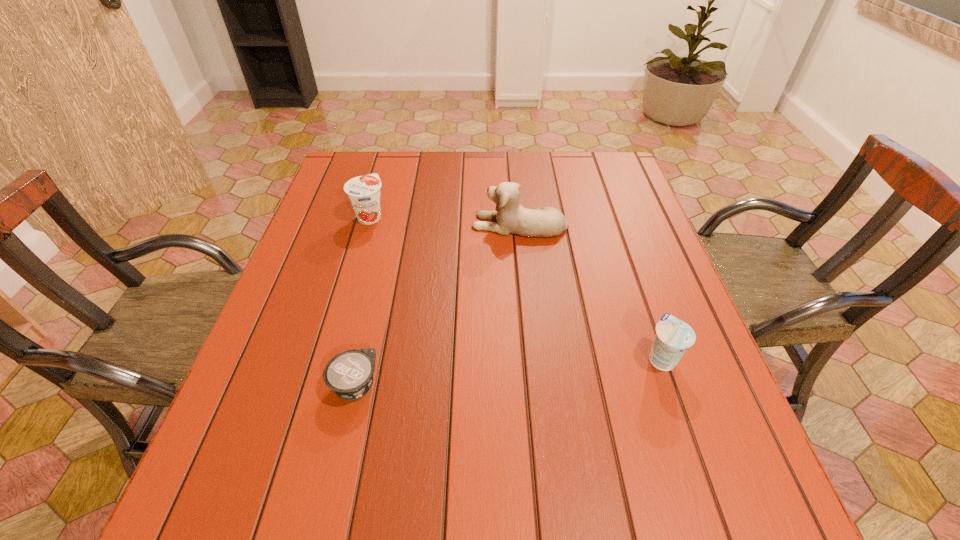
Find the location of `free space that is in between the shortest yogurt and the rightmost yogurt`. free space that is in between the shortest yogurt and the rightmost yogurt is located at coordinates (508, 372).

You are a GUI agent. You are given a task and a screenshot of the screen. Output one action in this format:
    pyautogui.click(x=<x>, y=<y>)
    Task: Click on the free area in between the shortest yogurt and the farthest yogurt
    
    Given the screenshot: What is the action you would take?
    pyautogui.click(x=363, y=301)

You are a GUI agent. You are given a task and a screenshot of the screen. Output one action in this format:
    pyautogui.click(x=<x>, y=<y>)
    Task: Click on the blank region between the rightmost yogurt and the shortest yogurt
    The image size is (960, 540).
    Given the screenshot: What is the action you would take?
    pyautogui.click(x=508, y=372)

Where is `free space between the rightmost object and the tallest object`? The image size is (960, 540). free space between the rightmost object and the tallest object is located at coordinates pos(590,291).

This screenshot has width=960, height=540. What are the coordinates of `empty location between the shortest object and the farthest yogurt` in the screenshot? It's located at (363, 301).

The width and height of the screenshot is (960, 540). I want to click on blank region between the shortest yogurt and the farthest yogurt, so click(363, 301).

Locate an element on the screen. vacant point located between the rightmost yogurt and the shortest yogurt is located at coordinates (508, 372).

You are a GUI agent. You are given a task and a screenshot of the screen. Output one action in this format:
    pyautogui.click(x=<x>, y=<y>)
    Task: Click on the vacant area that lies between the rightmost object and the shortest yogurt
    
    Given the screenshot: What is the action you would take?
    pyautogui.click(x=508, y=372)

Where is `free space between the shortest object and the tallest object`? The image size is (960, 540). free space between the shortest object and the tallest object is located at coordinates (437, 305).

The image size is (960, 540). I want to click on the closest object to the shortest yogurt, so click(512, 218).